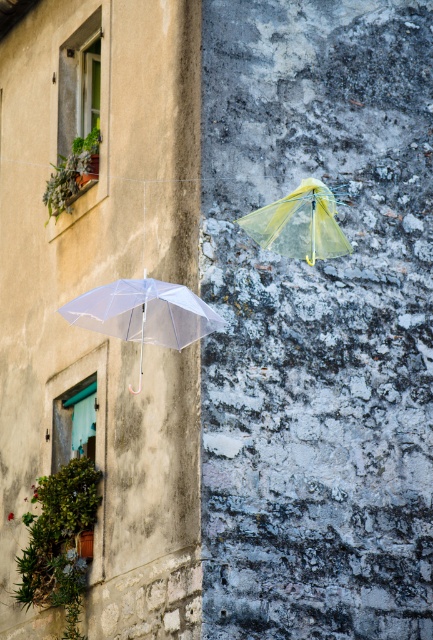
You are an interior designer planning to hang two transparent umbrellas in a modern gallery space. The transparent plastic umbrella at lower left and the transparent nylon umbrella at center must be arranged so that the smaller one is placed above the larger one. Can you confirm if this arrangement is possible based on their current sizes?

The transparent plastic umbrella at lower left is smaller than the transparent nylon umbrella at center, so arranging the smaller one above the larger one is possible as it meets the size requirement.

You are an architect analyzing the image. You need to determine the exact location of the transparent plastic umbrella at lower left. What are its coordinates?

The transparent plastic umbrella at lower left is located at coordinates point (144,314).

You are standing in front of two suspended umbrellas in an open space. You notice a point marked at coordinates point (168, 321). Considering the scene described, can you estimate how far this point is from your current position?

The point (168, 321) is 32.91 meters away from the viewer.